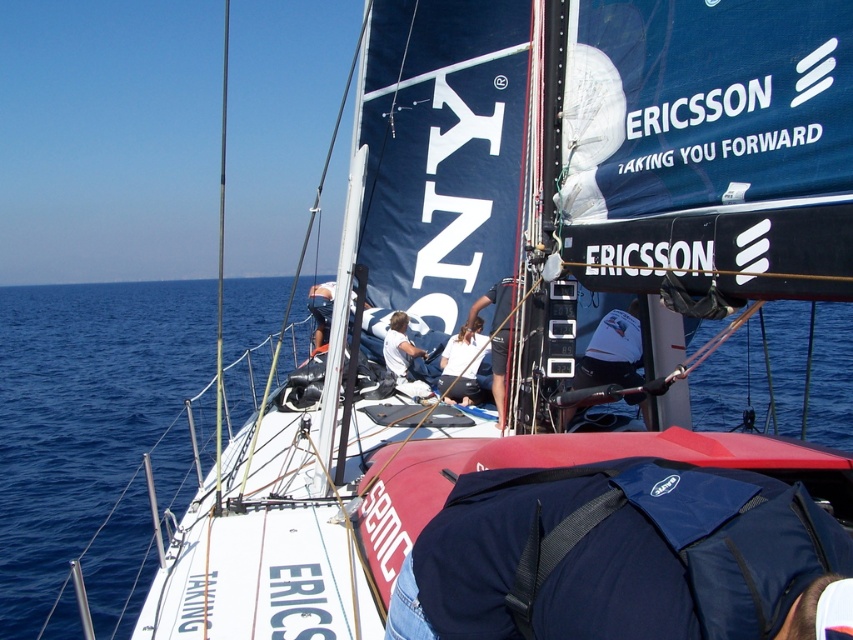
You are a crew member on the sailboat and need to retrieve an item from the blue fabric bag at center. However, the white fabric shirt at center is blocking your access. Can you move the shirt to access the bag?

The blue fabric bag at center is in front of the white fabric shirt at center, meaning the bag is already positioned in front and not blocked by the shirt. Therefore, you don not need to move the shirt to access the bag.

In the scene shown: You are a crew member on the sailboat and need to locate two items on the deck. You see a white fabric at center and a white fabric shirt at center. Which item is positioned more to the right?

The white fabric at center is positioned more to the right than the white fabric shirt at center according to the description.